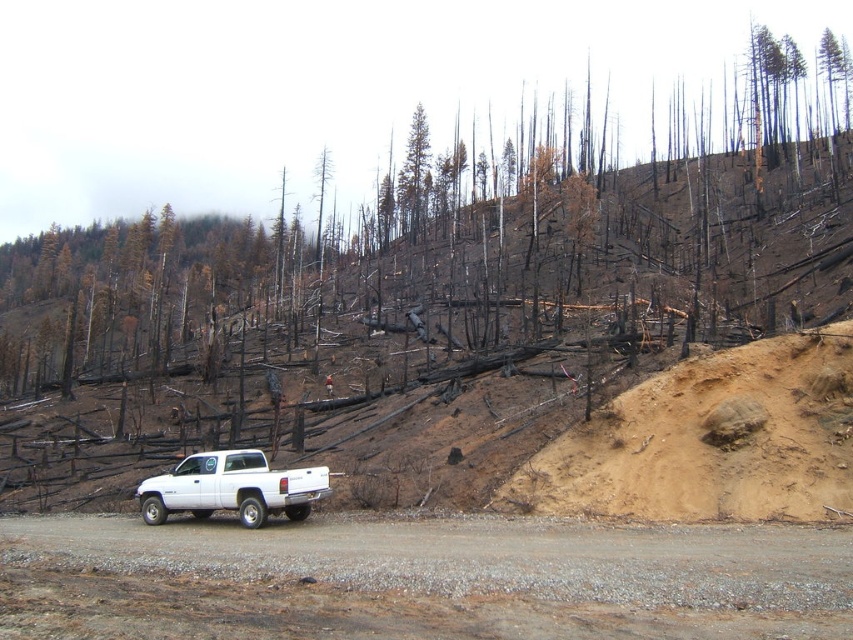
Question: Which point appears closest to the camera in this image?

Choices:
 (A) (828, 452)
 (B) (399, 122)
 (C) (405, 221)

Answer: (A)

Question: Among these objects, which one is farthest from the camera?

Choices:
 (A) white matte truck at center
 (B) burnt wood at center
 (C) brown bark tree at center

Answer: (B)

Question: Can you confirm if brown sandy hillside at center is smaller than brown bark tree at center?

Choices:
 (A) yes
 (B) no

Answer: (A)

Question: Can you confirm if brown sandy hillside at center is wider than white matte truck at center?

Choices:
 (A) yes
 (B) no

Answer: (A)

Question: Which of these objects is positioned farthest from the burnt wood at center?

Choices:
 (A) brown bark tree at center
 (B) brown sandy hillside at center
 (C) gray gravel road at center

Answer: (C)

Question: Is burnt wood at center closer to camera compared to brown bark tree at center?

Choices:
 (A) no
 (B) yes

Answer: (A)